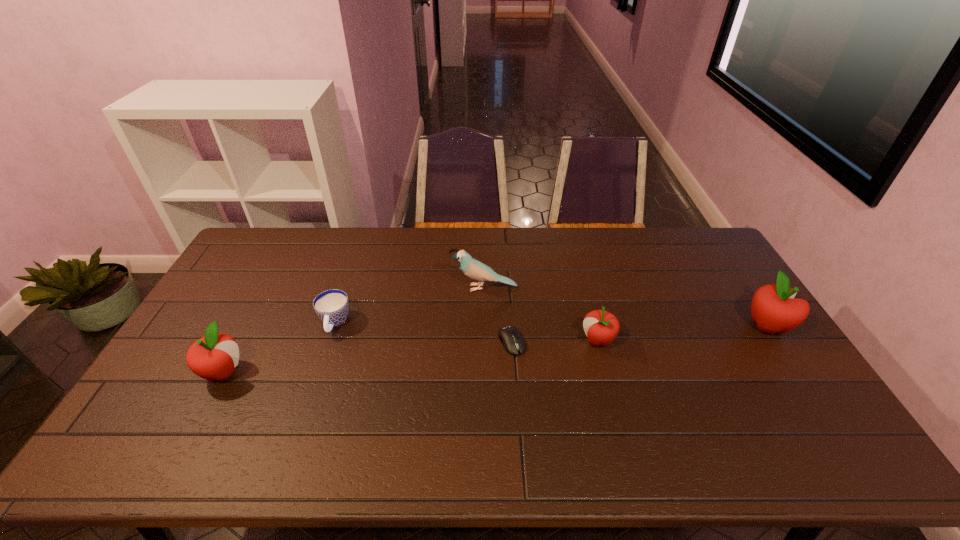
If equal spacing is the goal by inserting an additional apple among them, please point out a vacant space for this new apple. Please provide its 2D coordinates. Your answer should be formatted as a tuple, i.e. [(x, y)], where the tuple contains the x and y coordinates of a point satisfying the conditions above.

[(417, 356)]